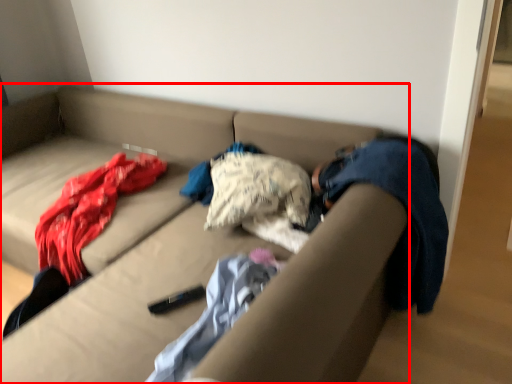
Question: Considering the relative positions of studio couch (annotated by the red box) and blanket in the image provided, where is studio couch (annotated by the red box) located with respect to the staircase?

Choices:
 (A) left
 (B) right

Answer: (A)